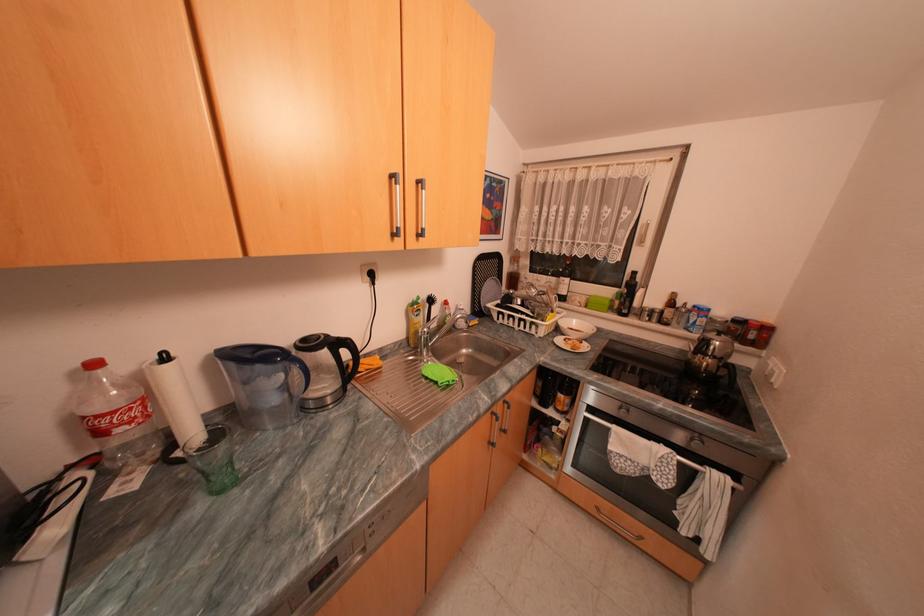
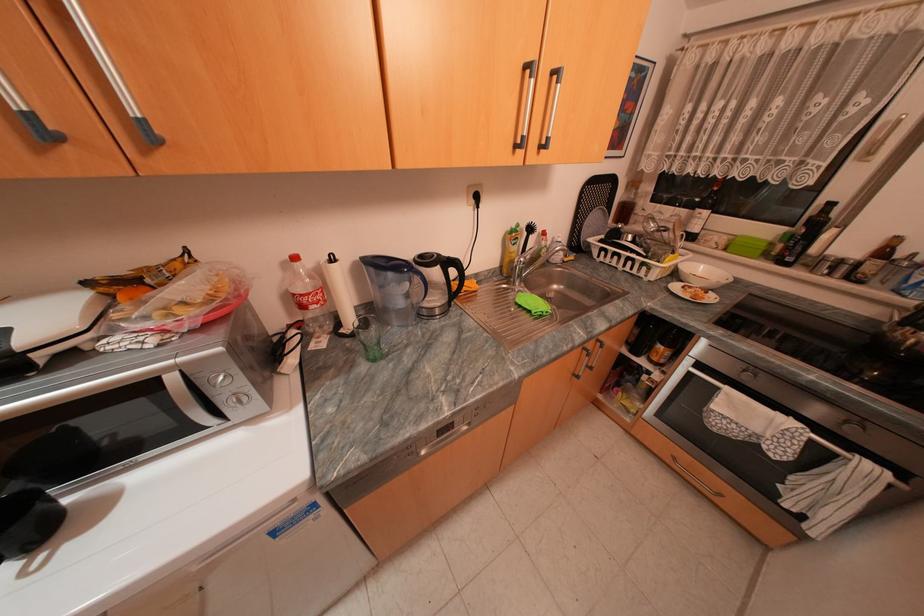
Find the pixel in the second image that matches (x=289, y=365) in the first image.

(416, 275)